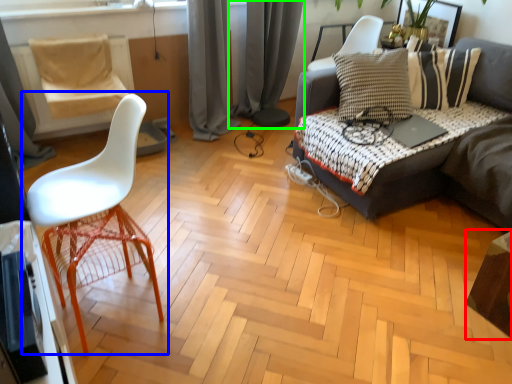
Question: Considering the real-world distances, which object is closest to table (highlighted by a red box)? chair (highlighted by a blue box) or curtain (highlighted by a green box).

Choices:
 (A) chair
 (B) curtain

Answer: (A)